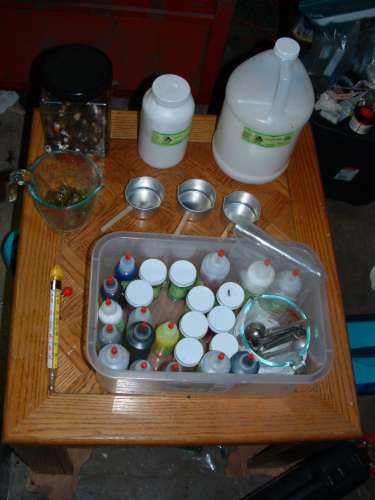
Where is `thermometer`? thermometer is located at coordinates (53, 334).